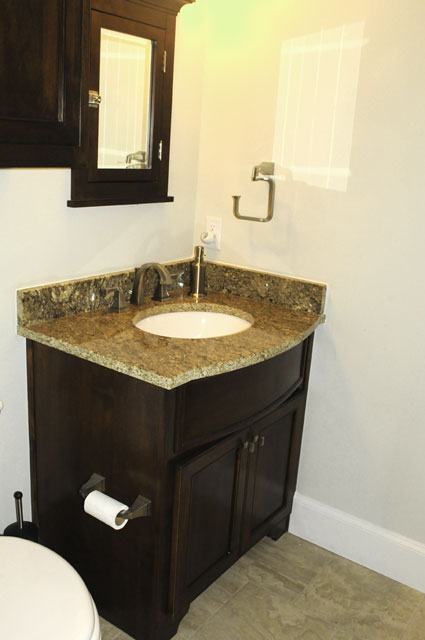
Identify the location of bathroom cabinet. (124, 416).